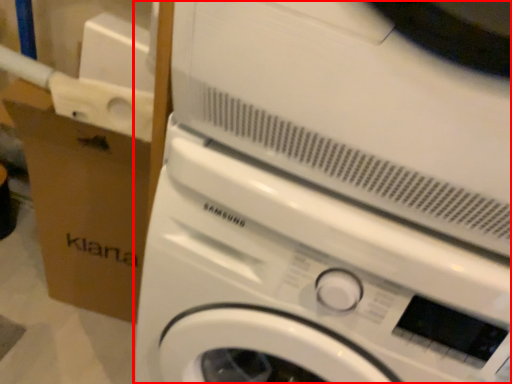
Question: From the image's perspective, where is washing machine (annotated by the red box) located in relation to cardboard box in the image?

Choices:
 (A) above
 (B) below

Answer: (B)